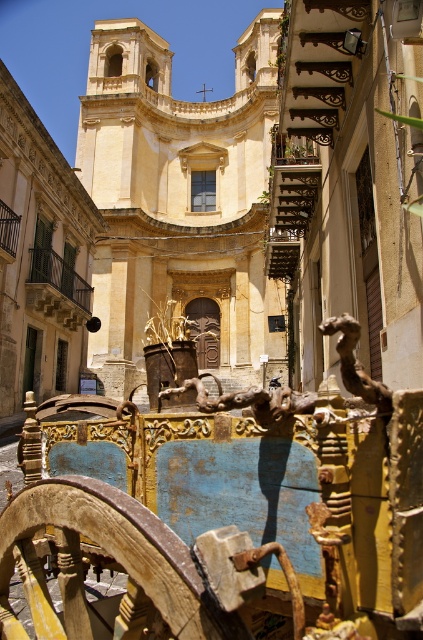
You are a tourist standing on the narrow street and want to take a photo of both the rusty wood cart at center and the yellow stone church at center. Can you position yourself so that both objects are visible in the frame without moving either of them?

The rusty wood cart at center is located below the yellow stone church at center, so yes, you can position yourself at a lower angle to capture both the rusty wood cart at center and the yellow stone church at center in the same frame.

You are a tourist standing on the narrow street and want to take a photo of the yellow stone church at center without any obstructions. Is the rusty wood cart at center blocking your view of the church?

The rusty wood cart at center is in front of the yellow stone church at center, so it is blocking the view of the church. Move the cart or reposition yourself to capture an unobstructed view of the yellow stone church at center.